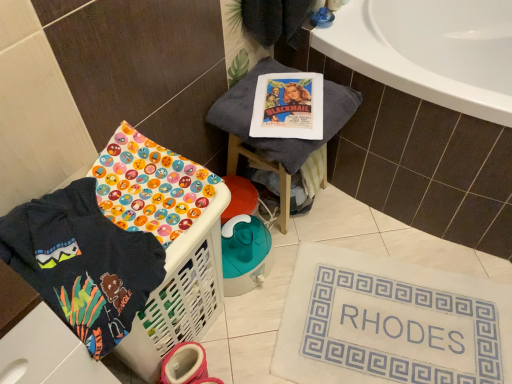
Locate an element on the screen. The height and width of the screenshot is (384, 512). free spot above gray fabric stool at upper center (from a real-world perspective) is located at coordinates (287, 98).